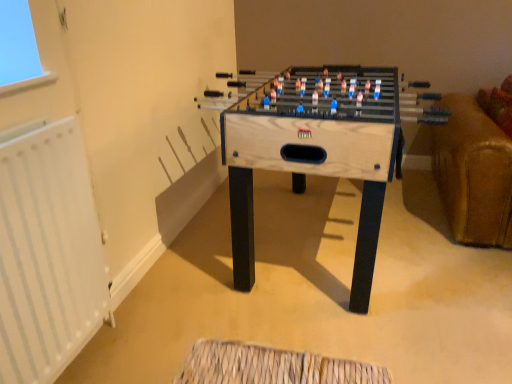
Question: Which is correct: white metallic radiator at left is inside wooden foosball table at center, or outside of it?

Choices:
 (A) outside
 (B) inside

Answer: (A)

Question: Is white metallic radiator at left taller or shorter than wooden foosball table at center?

Choices:
 (A) short
 (B) tall

Answer: (B)

Question: Considering the positions of point (50, 150) and point (336, 122), is point (50, 150) closer or farther from the camera than point (336, 122)?

Choices:
 (A) farther
 (B) closer

Answer: (B)

Question: From a real-world perspective, is wooden foosball table at center above or below white metallic radiator at left?

Choices:
 (A) above
 (B) below

Answer: (B)

Question: Relative to white metallic radiator at left, is wooden foosball table at center in front or behind?

Choices:
 (A) front
 (B) behind

Answer: (B)

Question: Looking at the image, does wooden foosball table at center seem bigger or smaller compared to white metallic radiator at left?

Choices:
 (A) small
 (B) big

Answer: (B)

Question: From the image's perspective, is wooden foosball table at center positioned above or below white metallic radiator at left?

Choices:
 (A) below
 (B) above

Answer: (B)